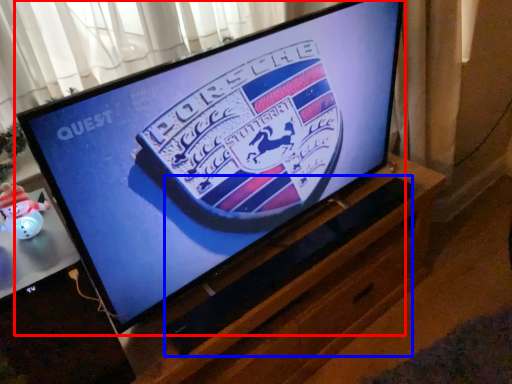
Question: Which point is closer to the camera, television (highlighted by a red box) or speaker (highlighted by a blue box)?

Choices:
 (A) television
 (B) speaker

Answer: (A)